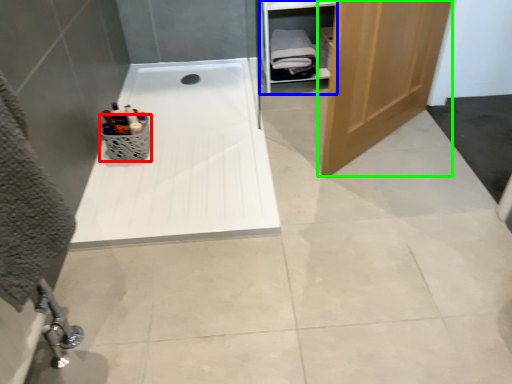
Question: Estimate the real-world distances between objects in this image. Which object is farther from basket (highlighted by a red box), cabinet (highlighted by a blue box) or door (highlighted by a green box)?

Choices:
 (A) cabinet
 (B) door

Answer: (A)